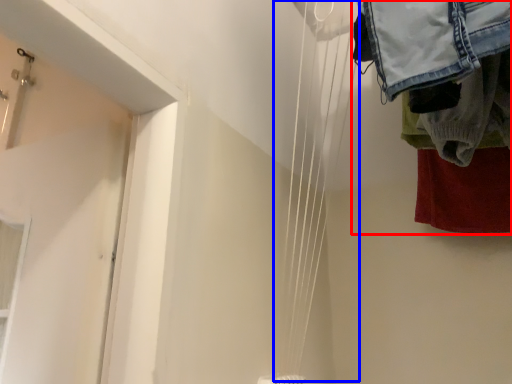
Question: Which point is further to the camera, laundry (highlighted by a red box) or wire (highlighted by a blue box)?

Choices:
 (A) laundry
 (B) wire

Answer: (A)